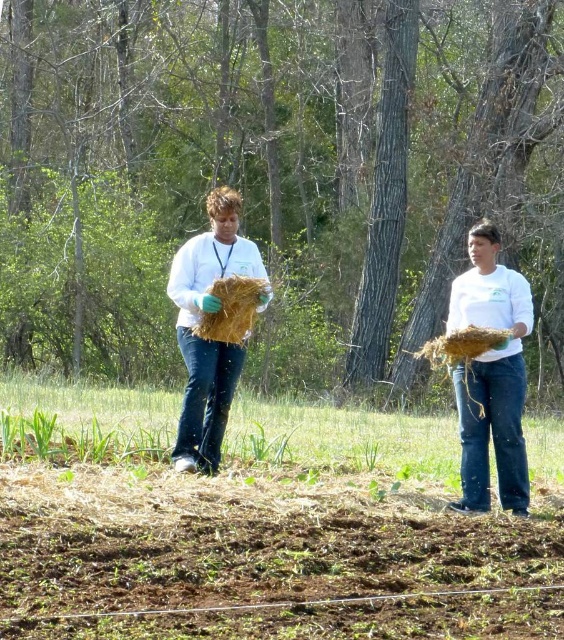
You are standing in the forest and see two points marked in the image. Which point is closer to you, point (x=535, y=467) or point (x=514, y=467)?

Point (x=535, y=467) is further to the camera than point (x=514, y=467), so the closer point to you is point (x=514, y=467).

You are a farmer who needs to choose between the matte straw bundle at center and the brown straw at center for a project that requires a larger amount of straw. Which one should you pick?

The brown straw at center is larger in size compared to the matte straw bundle at center, so you should pick the brown straw at center for the project that requires a larger amount of straw.